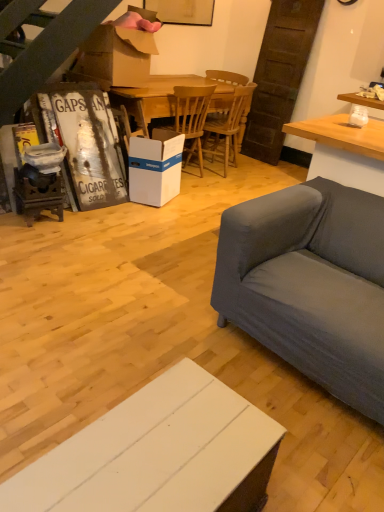
This screenshot has width=384, height=512. I want to click on empty space that is ontop of white wood cabinet at lower center (from a real-world perspective), so click(167, 448).